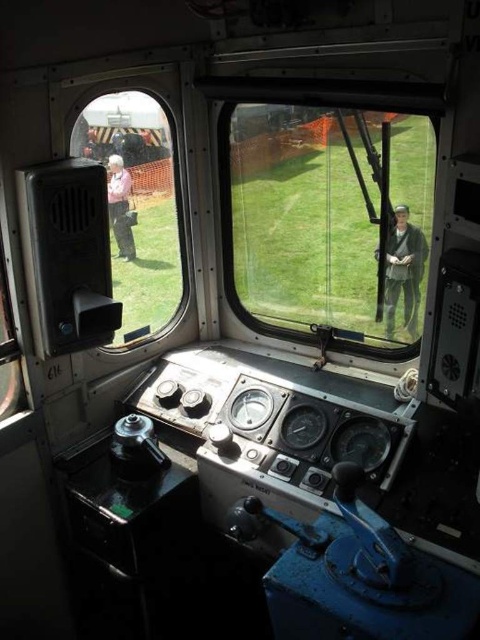
Question: Can you confirm if clear glass window at center is wider than camouflage fabric jacket at center?

Choices:
 (A) yes
 (B) no

Answer: (A)

Question: Which of the following is the farthest from the observer?

Choices:
 (A) (241, 202)
 (B) (119, 268)

Answer: (A)

Question: Which of the following is the farthest from the observer?

Choices:
 (A) (121, 243)
 (B) (396, 275)

Answer: (A)

Question: Which of the following is the farthest from the observer?

Choices:
 (A) camouflage fabric jacket at center
 (B) pink fabric at left
 (C) clear glass window at left

Answer: (B)

Question: Can you confirm if camouflage fabric jacket at center is smaller than pink fabric at left?

Choices:
 (A) no
 (B) yes

Answer: (A)

Question: Can you confirm if camouflage fabric jacket at center is positioned below pink fabric at left?

Choices:
 (A) yes
 (B) no

Answer: (A)